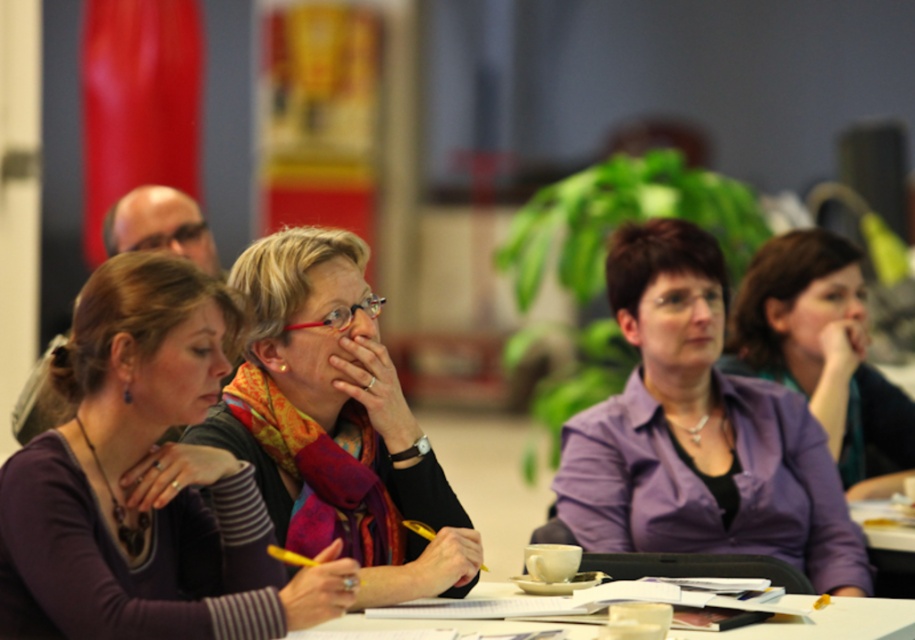
Which is below, matte purple shirt at center or purple matte shirt at center?

matte purple shirt at center is lower down.

Does point (66, 572) come in front of point (857, 321)?

Yes, it is.

Where is `matte purple shirt at center`? The image size is (915, 640). matte purple shirt at center is located at coordinates (126, 490).

Who is lower down, matte purple shirt at center or matte black scarf at center?

matte purple shirt at center is lower down.

Consider the image. Who is more forward, (0, 576) or (389, 595)?

Positioned in front is point (0, 576).

Between point (169, 416) and point (474, 532), which one is positioned behind?

The point (474, 532) is more distant.

At what (x,y) coordinates should I click in order to perform the action: click on matte purple shirt at center. Please return your answer as a coordinate pair (x, y). The width and height of the screenshot is (915, 640). Looking at the image, I should click on (126, 490).

Between point (200, 544) and point (911, 612), which one is positioned in front?

Point (200, 544) is more forward.

Does point (110, 525) come behind point (908, 627)?

That is False.

At what (x,y) coordinates should I click in order to perform the action: click on matte purple shirt at center. Please return your answer as a coordinate pair (x, y). This screenshot has width=915, height=640. Looking at the image, I should click on (126, 490).